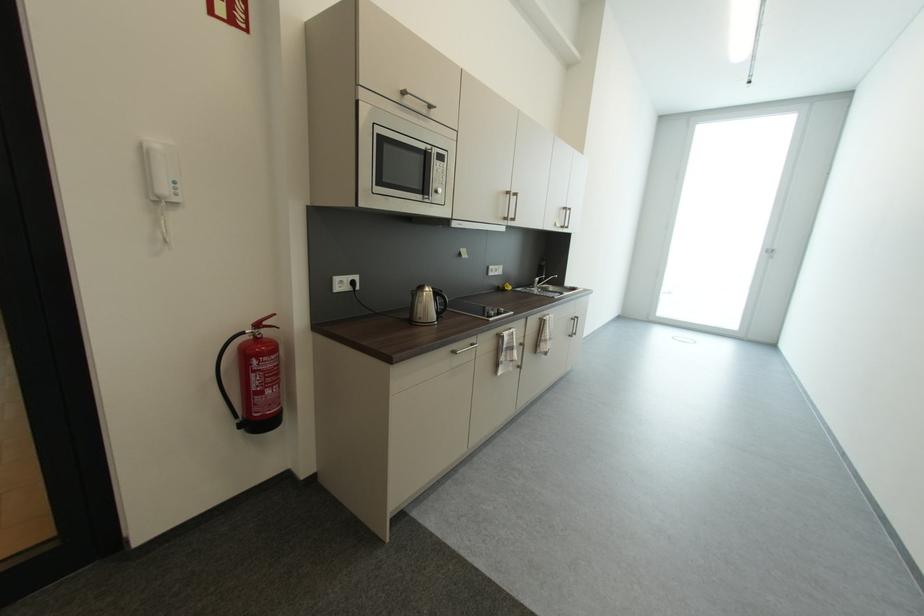
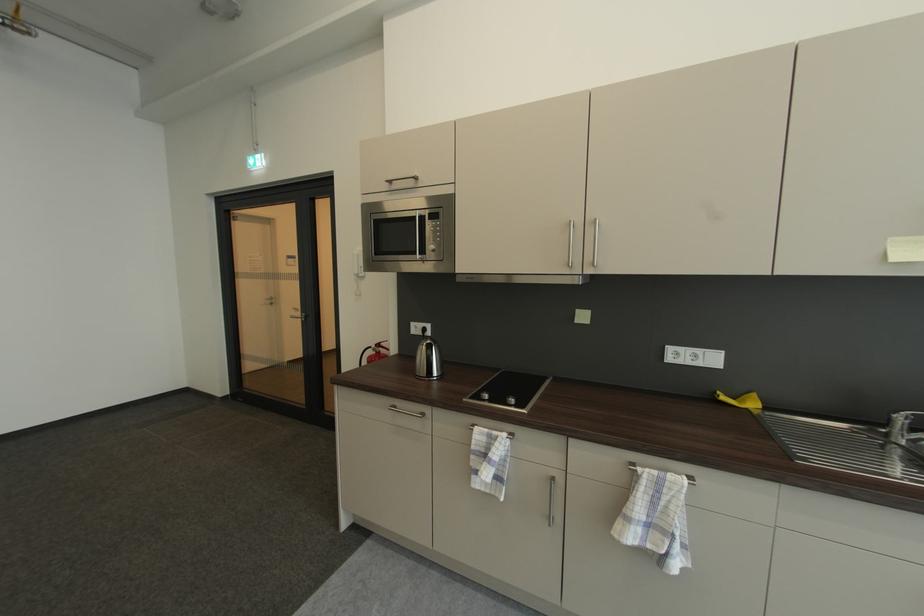
Find the pixel in the second image that matches [264,326] in the first image.

(384, 347)